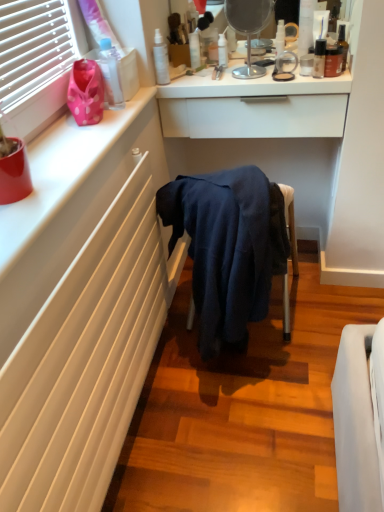
At what (x,y) coordinates should I click in order to perform the action: click on free space to the left of matte brown bottle at upper right, the seventh toiletry in the left-to-right sequence. Please return your answer as a coordinate pair (x, y). The width and height of the screenshot is (384, 512). Looking at the image, I should click on (280, 78).